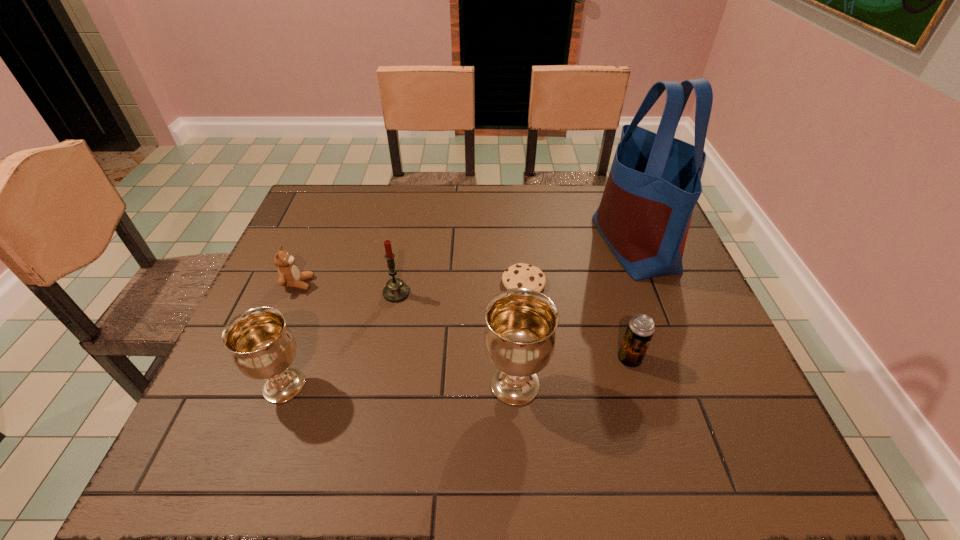
Where is `blank space located 0.160m on the right of the fifth object from right to left`? blank space located 0.160m on the right of the fifth object from right to left is located at coordinates (471, 293).

Locate an element on the screen. Image resolution: width=960 pixels, height=540 pixels. vacant space located on the front-facing side of the teddy bear is located at coordinates (423, 284).

The width and height of the screenshot is (960, 540). Identify the location of free region located on the left of the handbag. (512, 244).

You are a GUI agent. You are given a task and a screenshot of the screen. Output one action in this format:
    pyautogui.click(x=<x>, y=<y>)
    Task: Click on the free space located 0.340m on the back of the shortest object
    The height and width of the screenshot is (540, 960).
    Given the screenshot: What is the action you would take?
    pyautogui.click(x=516, y=198)

At what (x,y) coordinates should I click in order to perform the action: click on free space located on the back of the beer can. Please return your answer as a coordinate pair (x, y). Looking at the image, I should click on (609, 287).

Where is `object at the far edge`? The height and width of the screenshot is (540, 960). object at the far edge is located at coordinates (654, 183).

The width and height of the screenshot is (960, 540). Find the location of `chalice that is at the left edge`. chalice that is at the left edge is located at coordinates (262, 347).

Identify the location of teddy bear that is positioned at the left edge. The height and width of the screenshot is (540, 960). (288, 273).

Find the location of `object that is at the right edge`. object that is at the right edge is located at coordinates (654, 183).

The width and height of the screenshot is (960, 540). Find the location of `object that is at the near left corner`. object that is at the near left corner is located at coordinates (262, 347).